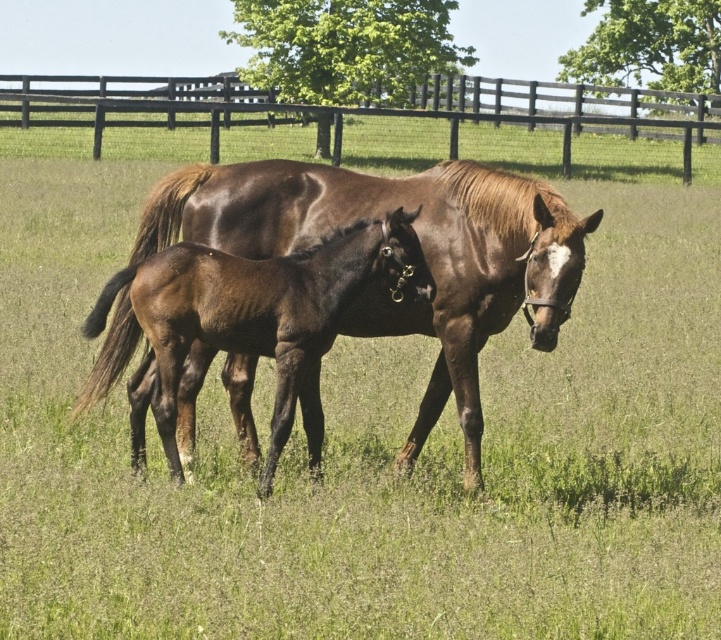
Question: Which point is closer to the camera taking this photo?

Choices:
 (A) (242, 435)
 (B) (257, 116)

Answer: (A)

Question: Is brown glossy horse at center above brown wooden fence at upper center?

Choices:
 (A) yes
 (B) no

Answer: (B)

Question: Which of the following is the closest to the observer?

Choices:
 (A) brown glossy horse at center
 (B) brown wooden fence at upper center

Answer: (A)

Question: Is brown glossy horse at center wider than brown wooden fence at upper center?

Choices:
 (A) yes
 (B) no

Answer: (B)

Question: Is brown glossy horse at center further to camera compared to brown wooden fence at upper center?

Choices:
 (A) no
 (B) yes

Answer: (A)